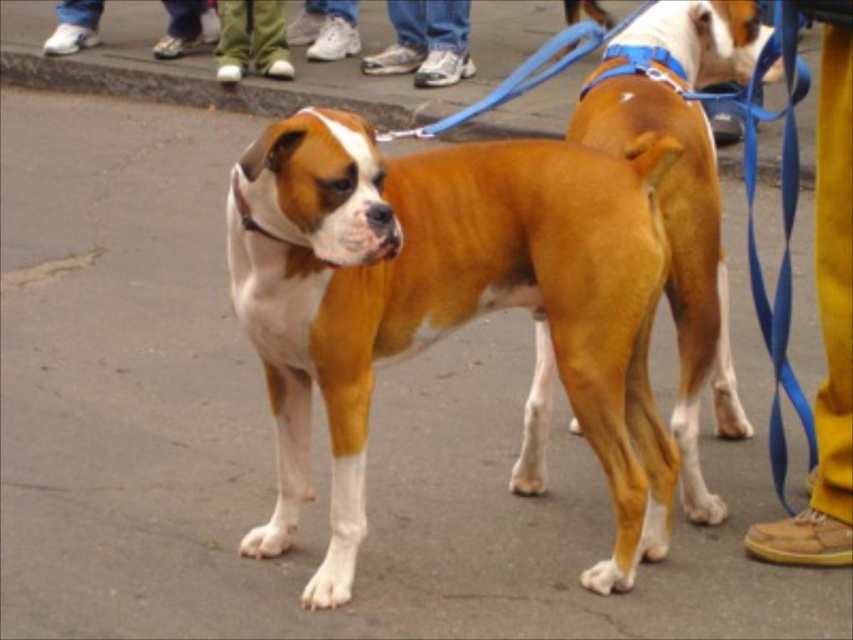
Question: Based on their relative distances, which object is farther from the white leather shoe at center?

Choices:
 (A) green fabric pants at upper center
 (B) yellow fabric pants at lower right
 (C) golden-brown fur dog at center
 (D) brown glossy dog at center

Answer: (B)

Question: Is golden-brown fur dog at center bigger than yellow fabric pants at lower right?

Choices:
 (A) no
 (B) yes

Answer: (B)

Question: Is blue fabric leash at center below green fabric pants at upper center?

Choices:
 (A) yes
 (B) no

Answer: (A)

Question: Estimate the real-world distances between objects in this image. Which object is closer to the white leather shoe at lower center?

Choices:
 (A) green fabric pants at upper center
 (B) white leather shoe at center
 (C) blue fabric leash at center

Answer: (B)

Question: Which point is closer to the camera?

Choices:
 (A) white leather shoe at center
 (B) blue fabric leash at center
 (C) golden-brown fur dog at center
 (D) white leather shoe at lower center

Answer: (C)

Question: Is green fabric pants at upper center positioned in front of white leather shoes at lower left?

Choices:
 (A) yes
 (B) no

Answer: (A)